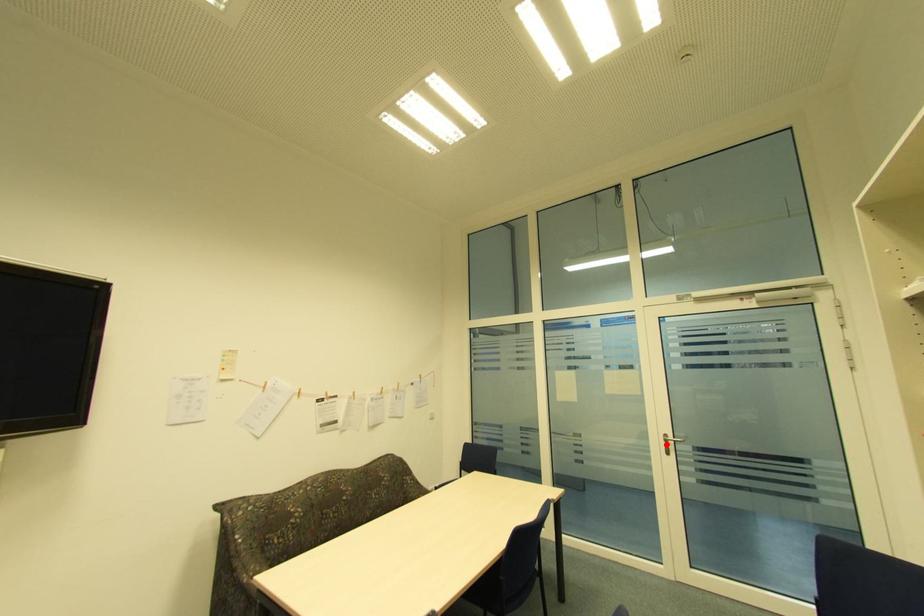
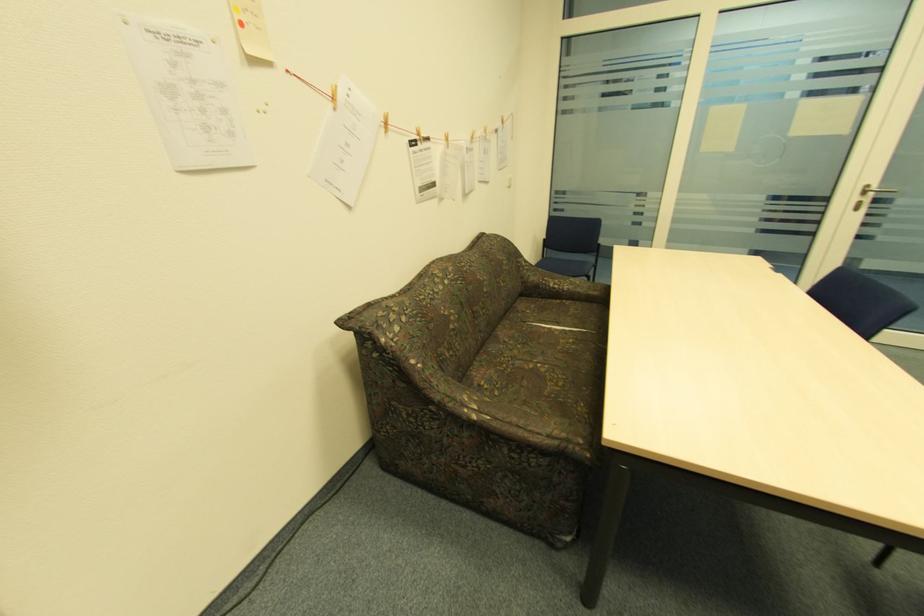
Where in the second image is the point corresponding to the highlighted location from the first image?

(859, 199)